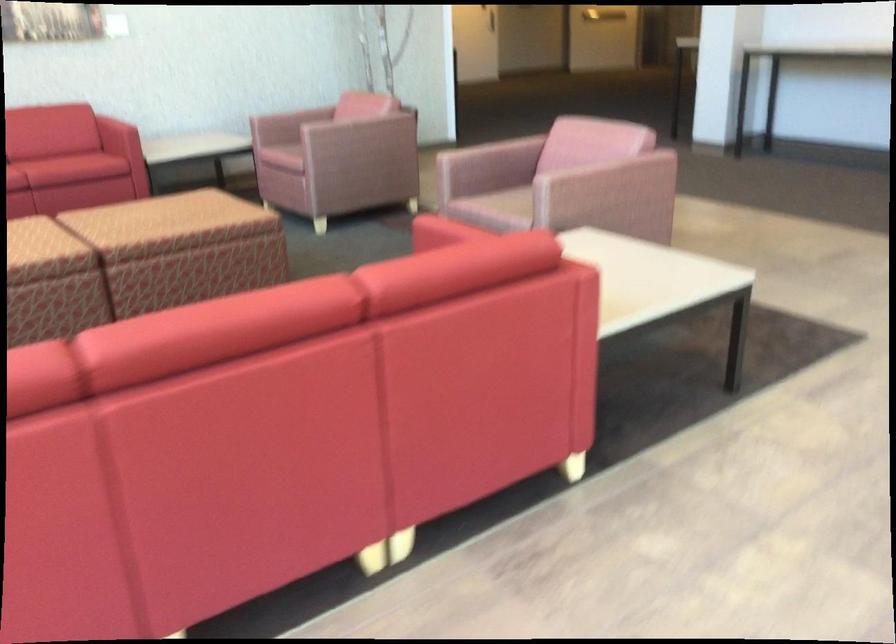
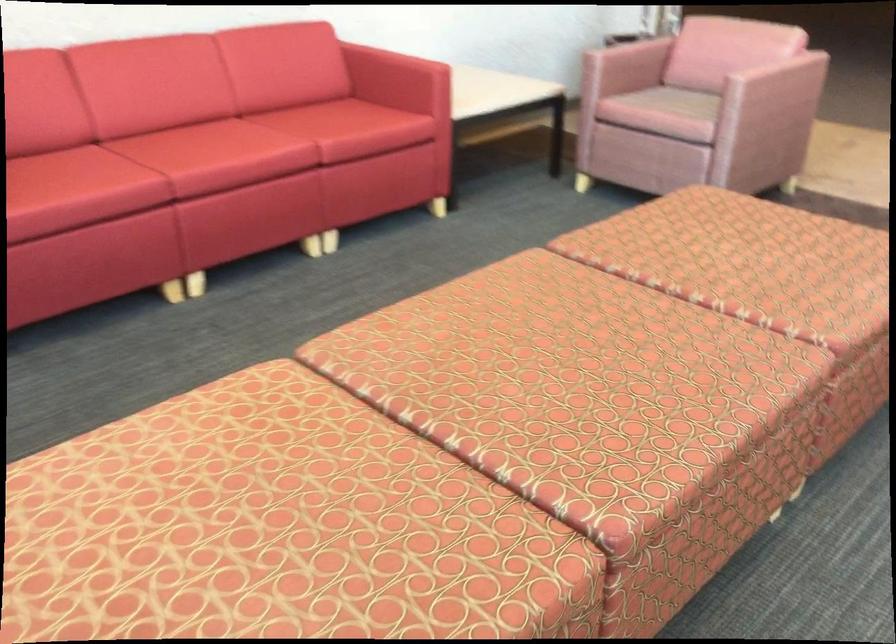
Question: I am providing you with two images of the same scene from different viewpoints. After the viewpoint changes to image2, which objects are now occluded?

Choices:
 (A) sofa sitting surface
 (B) sofa armrest
 (C) chair armrest
 (D) none of these

Answer: (D)